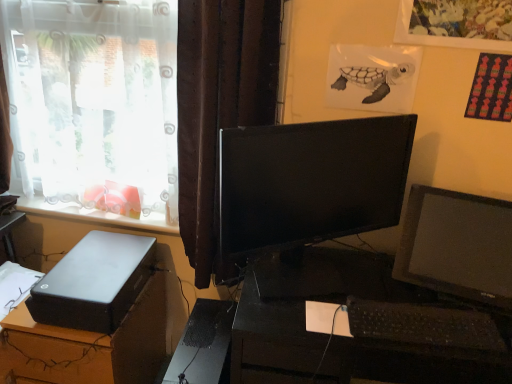
Question: From a real-world perspective, is black matte computer tower at lower left below white plastic window sill at lower left?

Choices:
 (A) yes
 (B) no

Answer: (A)

Question: Is black matte computer tower at lower left oriented away from white plastic window sill at lower left?

Choices:
 (A) no
 (B) yes

Answer: (A)

Question: Can you confirm if black matte computer tower at lower left is bigger than white plastic window sill at lower left?

Choices:
 (A) no
 (B) yes

Answer: (B)

Question: Is black matte computer tower at lower left to the right of white plastic window sill at lower left from the viewer's perspective?

Choices:
 (A) no
 (B) yes

Answer: (B)

Question: Considering the relative positions of black matte computer tower at lower left and white plastic window sill at lower left in the image provided, is black matte computer tower at lower left to the left of white plastic window sill at lower left from the viewer's perspective?

Choices:
 (A) yes
 (B) no

Answer: (B)

Question: In the image, is black plastic desk at center, which is counted as the 1th desk, starting from the right, on the left side or the right side of black plastic keyboard at lower right?

Choices:
 (A) left
 (B) right

Answer: (A)

Question: From a real-world perspective, relative to black plastic keyboard at lower right, is black plastic desk at center, the second desk from the left, vertically above or below?

Choices:
 (A) below
 (B) above

Answer: (A)

Question: Is point (252, 301) positioned closer to the camera than point (429, 344)?

Choices:
 (A) farther
 (B) closer

Answer: (A)

Question: Relative to black plastic keyboard at lower right, is black plastic desk at center, the second desk from the left, in front or behind?

Choices:
 (A) behind
 (B) front

Answer: (B)

Question: In the image, is black plastic desk at center, which is counted as the 1th desk, starting from the right, on the left side or the right side of black matte computer tower at lower left?

Choices:
 (A) left
 (B) right

Answer: (B)

Question: Is black plastic desk at center, the second desk from the left, situated inside black matte computer tower at lower left or outside?

Choices:
 (A) outside
 (B) inside

Answer: (A)

Question: Looking at the image, does black plastic desk at center, the second desk from the left, seem bigger or smaller compared to black matte computer tower at lower left?

Choices:
 (A) big
 (B) small

Answer: (A)

Question: In terms of width, does black plastic desk at center, the second desk from the left, look wider or thinner when compared to black matte computer tower at lower left?

Choices:
 (A) wide
 (B) thin

Answer: (A)

Question: From the image's perspective, is white plastic window sill at lower left positioned above or below satin black desktop at lower left, which is counted as the first desk, starting from the left?

Choices:
 (A) above
 (B) below

Answer: (A)

Question: In the image, is white plastic window sill at lower left positioned in front of or behind satin black desktop at lower left, which is counted as the 2th desk, starting from the right?

Choices:
 (A) behind
 (B) front

Answer: (A)